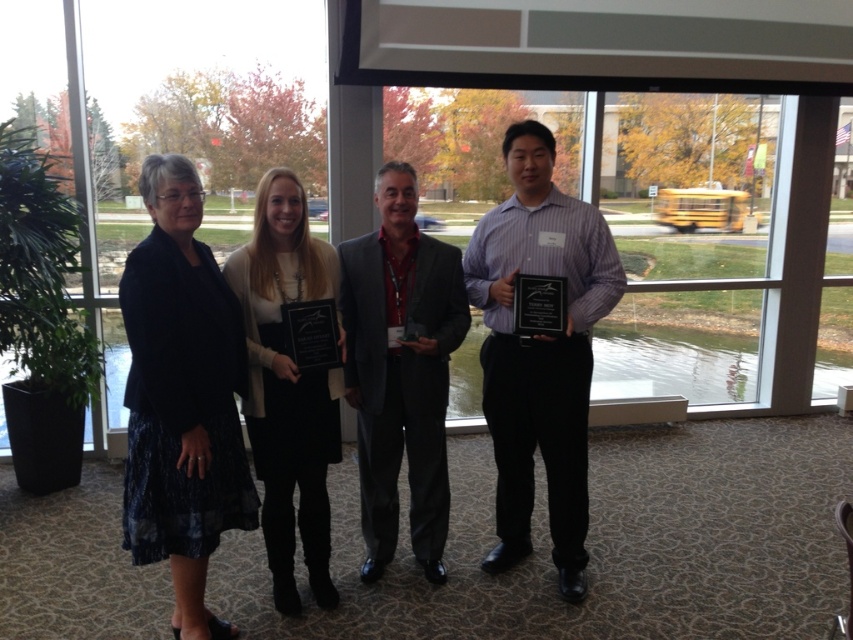
Which is above, purple shirt at center or dark gray suit at center?

purple shirt at center

In the scene shown: Does purple shirt at center appear on the right side of dark gray suit at center?

Yes, purple shirt at center is to the right of dark gray suit at center.

Is point (576, 556) closer to viewer compared to point (407, 184)?

No, (576, 556) is further to viewer.

Where is `purple shirt at center`? purple shirt at center is located at coordinates (538, 349).

Can you confirm if black glossy plaque at center is shorter than black glossy plaque at right?

In fact, black glossy plaque at center may be taller than black glossy plaque at right.

Is black glossy plaque at center to the left of black glossy plaque at right from the viewer's perspective?

Indeed, black glossy plaque at center is positioned on the left side of black glossy plaque at right.

The image size is (853, 640). I want to click on black glossy plaque at center, so click(x=311, y=333).

Can you confirm if dark blue textured skirt at left is positioned above matte black dress at center?

No, dark blue textured skirt at left is not above matte black dress at center.

Is point (143, 554) in front of point (323, 291)?

Yes, point (143, 554) is in front of point (323, 291).

Between point (169, 307) and point (323, 524), which one is positioned in front?

Point (169, 307)

At what (x,y) coordinates should I click in order to perform the action: click on dark blue textured skirt at left. Please return your answer as a coordinate pair (x, y). The image size is (853, 640). Looking at the image, I should click on (183, 397).